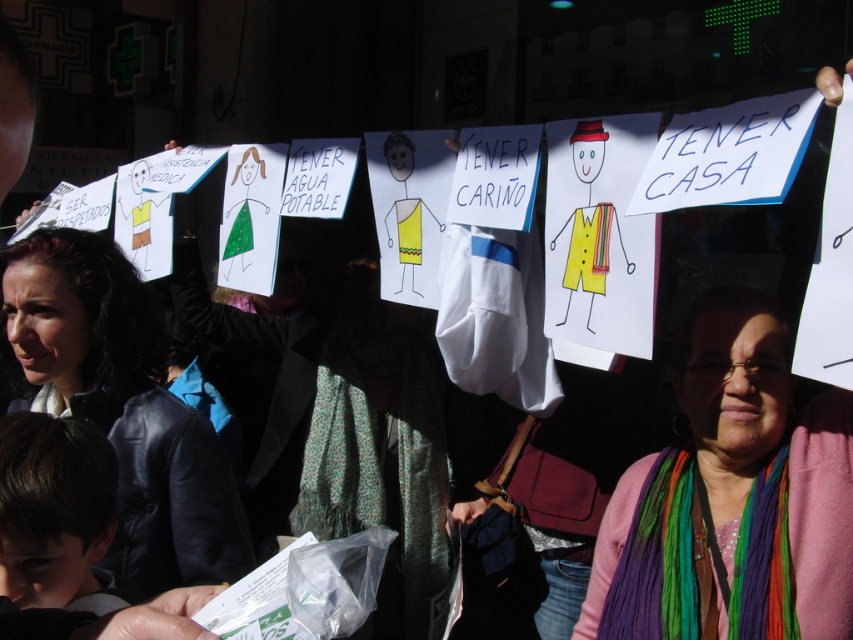
Question: Does multicolored scarf at center have a smaller size compared to matte black jacket at left?

Choices:
 (A) yes
 (B) no

Answer: (A)

Question: Which object appears farthest from the camera in this image?

Choices:
 (A) matte black jacket at left
 (B) multicolored scarf at center

Answer: (A)

Question: In this image, where is multicolored scarf at center located relative to matte black jacket at left?

Choices:
 (A) above
 (B) below

Answer: (B)

Question: Which point is closer to the camera?

Choices:
 (A) matte black jacket at left
 (B) multicolored scarf at center

Answer: (B)

Question: Can you confirm if multicolored scarf at center is thinner than matte black jacket at left?

Choices:
 (A) yes
 (B) no

Answer: (A)